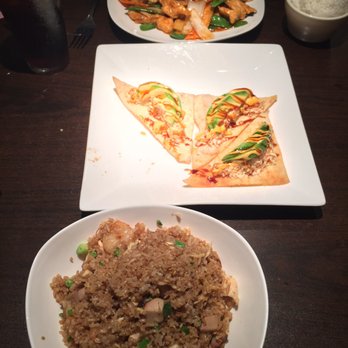
Identify the location of fork. (85, 28).